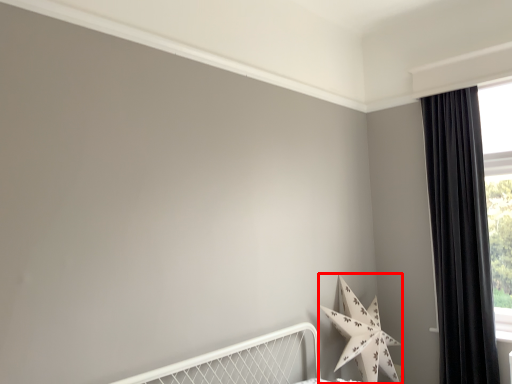
Question: From the image's perspective, where is star (annotated by the red box) located relative to curtain?

Choices:
 (A) below
 (B) above

Answer: (A)